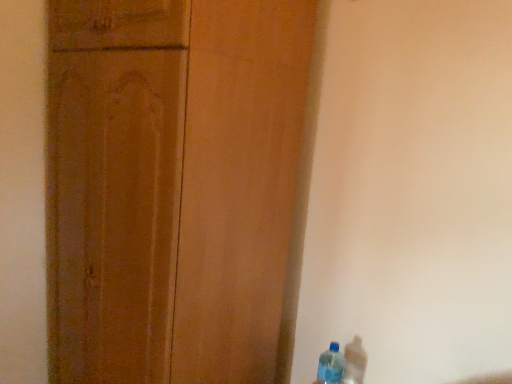
What do you see at coordinates (172, 186) in the screenshot? I see `wooden cupboard at left` at bounding box center [172, 186].

You are a GUI agent. You are given a task and a screenshot of the screen. Output one action in this format:
    pyautogui.click(x=<x>, y=<y>)
    Task: Click on the wooden cupboard at left
    The height and width of the screenshot is (384, 512).
    Given the screenshot: What is the action you would take?
    pyautogui.click(x=172, y=186)

Locate an element on the screen. This screenshot has height=384, width=512. wooden cupboard at left is located at coordinates (172, 186).